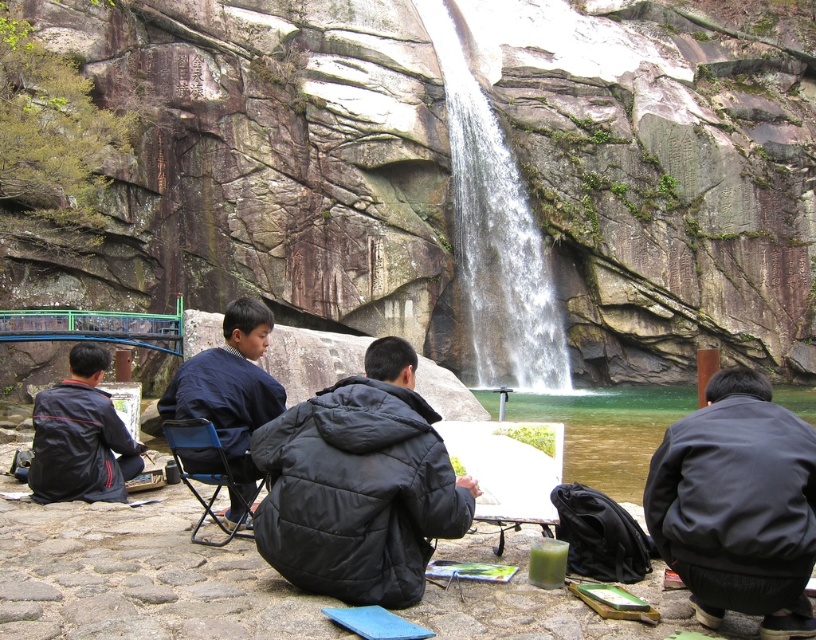
Question: Estimate the real-world distances between objects in this image. Which object is farther from the dark blue fabric jacket at center?

Choices:
 (A) black puffy jacket at center
 (B) white textured water at center
 (C) black matte jacket at lower left

Answer: (B)

Question: Is black puffy jacket at center above black matte jacket at lower left?

Choices:
 (A) no
 (B) yes

Answer: (A)

Question: Among these points, which one is farthest from the camera?

Choices:
 (A) (204, 417)
 (B) (582, 404)
 (C) (752, 538)
 (D) (440, 60)

Answer: (D)

Question: Considering the relative positions of black puffy jacket at center and white textured water at center in the image provided, where is black puffy jacket at center located with respect to white textured water at center?

Choices:
 (A) below
 (B) above

Answer: (A)

Question: Which is farther from the black puffy jacket at center?

Choices:
 (A) green smooth water at center
 (B) black matte jacket at lower left
 (C) white textured water at center
 (D) black matte jacket at lower right

Answer: (C)

Question: Can you confirm if white textured water at center is positioned above black matte jacket at lower left?

Choices:
 (A) no
 (B) yes

Answer: (B)